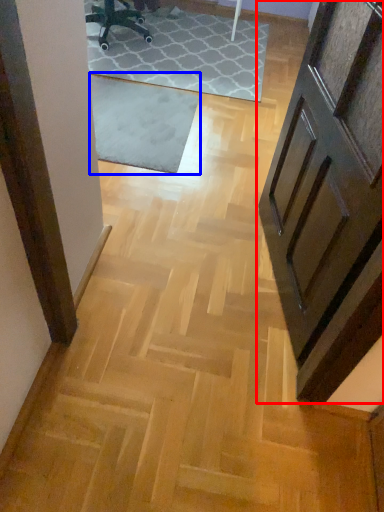
Question: Which object is closer to the camera taking this photo, door (highlighted by a red box) or mat (highlighted by a blue box)?

Choices:
 (A) door
 (B) mat

Answer: (A)